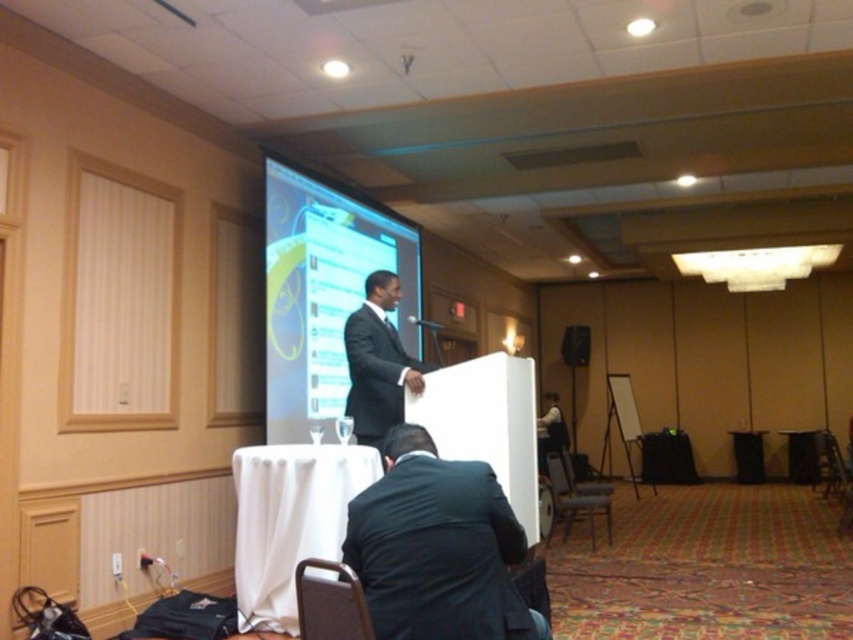
From the picture: You are standing at the entrance of the conference room and see two points marked on the floor. The first point is at coordinate point (325, 573) and the second point is at coordinate point (350, 384). Which point is closer to you?

Point (325, 573) is in front of point (350, 384), so it is closer to you.

You are standing at the entrance of the conference room and see two points marked on the floor. The first point is at coordinates point (440, 609) and the second point is at point (264, 604). Which point is closer to you?

Point (440, 609) is in front of point (264, 604), so it is closer to you.